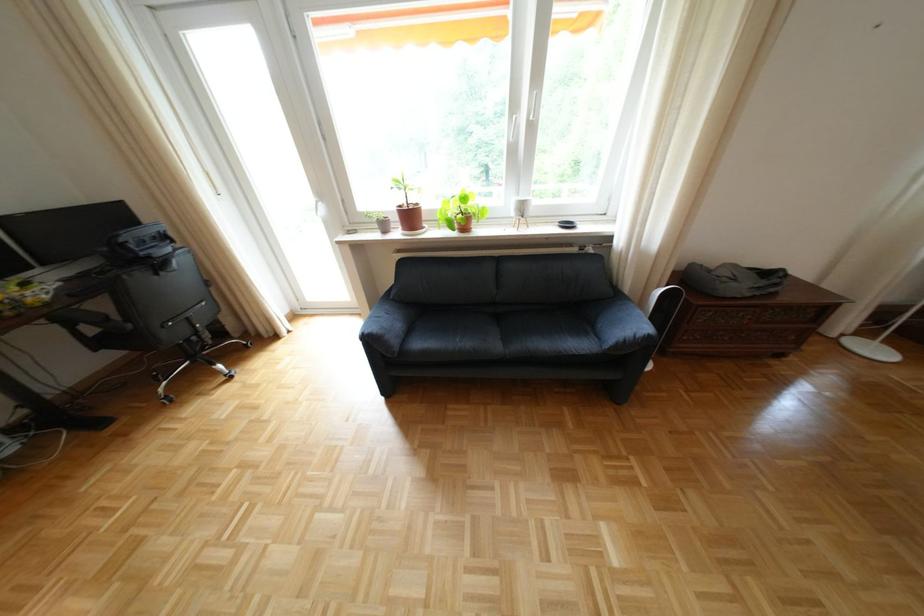
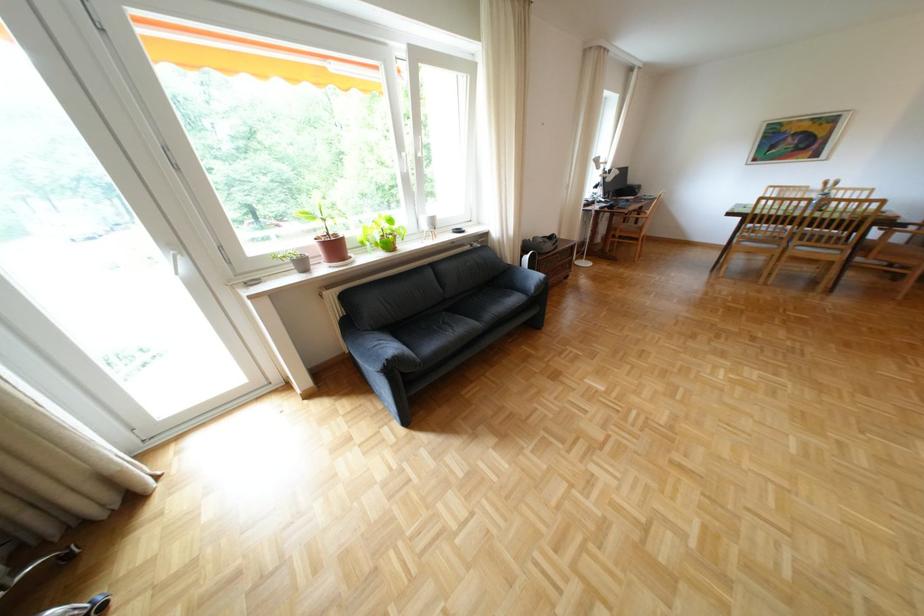
Question: How did the camera likely rotate?

Choices:
 (A) Left
 (B) Right
 (C) Up
 (D) Down

Answer: (B)